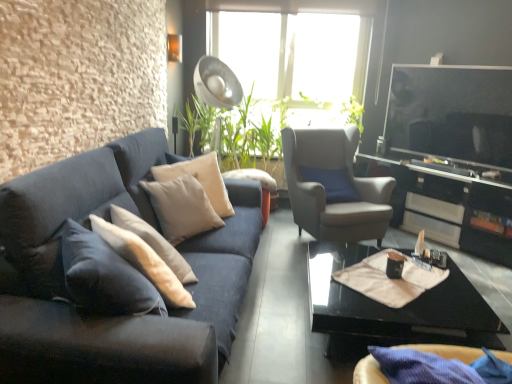
Question: Is creamy white fabric pillow at center, the second pillow when ordered from front to back, to the left of velvet dark blue couch at left from the viewer's perspective?

Choices:
 (A) yes
 (B) no

Answer: (B)

Question: Does creamy white fabric pillow at center, marked as the first pillow in a back-to-front arrangement, have a lesser height compared to velvet dark blue couch at left?

Choices:
 (A) yes
 (B) no

Answer: (A)

Question: Is creamy white fabric pillow at center, the second pillow when ordered from front to back, behind velvet dark blue couch at left?

Choices:
 (A) yes
 (B) no

Answer: (A)

Question: Is creamy white fabric pillow at center, marked as the first pillow in a back-to-front arrangement, bigger than velvet dark blue couch at left?

Choices:
 (A) yes
 (B) no

Answer: (B)

Question: Does creamy white fabric pillow at center, the second pillow when ordered from front to back, have a greater height compared to velvet dark blue couch at left?

Choices:
 (A) no
 (B) yes

Answer: (A)

Question: Considering the positions of creamy white fabric pillow at center, marked as the first pillow in a back-to-front arrangement, and beige fabric pillow at center, arranged as the 2th pillow when viewed from the back, in the image, is creamy white fabric pillow at center, marked as the first pillow in a back-to-front arrangement, wider or thinner than beige fabric pillow at center, arranged as the 2th pillow when viewed from the back,?

Choices:
 (A) thin
 (B) wide

Answer: (B)

Question: Would you say creamy white fabric pillow at center, marked as the first pillow in a back-to-front arrangement, is inside or outside beige fabric pillow at center, the first pillow in the front-to-back sequence?

Choices:
 (A) outside
 (B) inside

Answer: (A)

Question: From a real-world perspective, is creamy white fabric pillow at center, the second pillow when ordered from front to back, positioned above or below beige fabric pillow at center, the first pillow in the front-to-back sequence?

Choices:
 (A) below
 (B) above

Answer: (B)

Question: In terms of size, does creamy white fabric pillow at center, marked as the first pillow in a back-to-front arrangement, appear bigger or smaller than beige fabric pillow at center, arranged as the 2th pillow when viewed from the back?

Choices:
 (A) small
 (B) big

Answer: (B)

Question: Considering their positions, is beige fabric at center located in front of or behind suede-like gray armchair at center-right?

Choices:
 (A) behind
 (B) front

Answer: (B)

Question: Considering the positions of point (407, 289) and point (292, 145), is point (407, 289) closer or farther from the camera than point (292, 145)?

Choices:
 (A) closer
 (B) farther

Answer: (A)

Question: From a real-world perspective, is beige fabric at center physically located above or below suede-like gray armchair at center-right?

Choices:
 (A) below
 (B) above

Answer: (A)

Question: From the image's perspective, is beige fabric at center positioned above or below suede-like gray armchair at center-right?

Choices:
 (A) above
 (B) below

Answer: (B)

Question: Is black glossy entertainment center at right situated inside velvet dark blue couch at left or outside?

Choices:
 (A) outside
 (B) inside

Answer: (A)

Question: In terms of width, does black glossy entertainment center at right look wider or thinner when compared to velvet dark blue couch at left?

Choices:
 (A) thin
 (B) wide

Answer: (A)